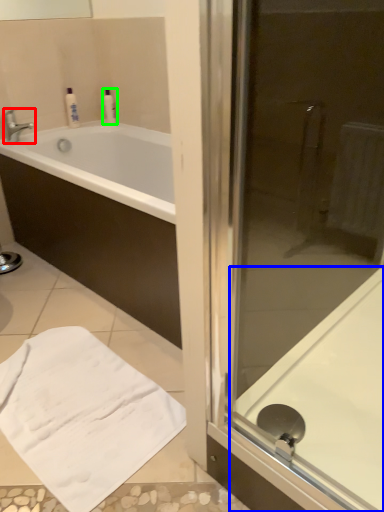
Question: Considering the real-world distances, which object is farthest from tap (highlighted by a red box)? bath (highlighted by a blue box) or toiletry (highlighted by a green box)?

Choices:
 (A) bath
 (B) toiletry

Answer: (A)